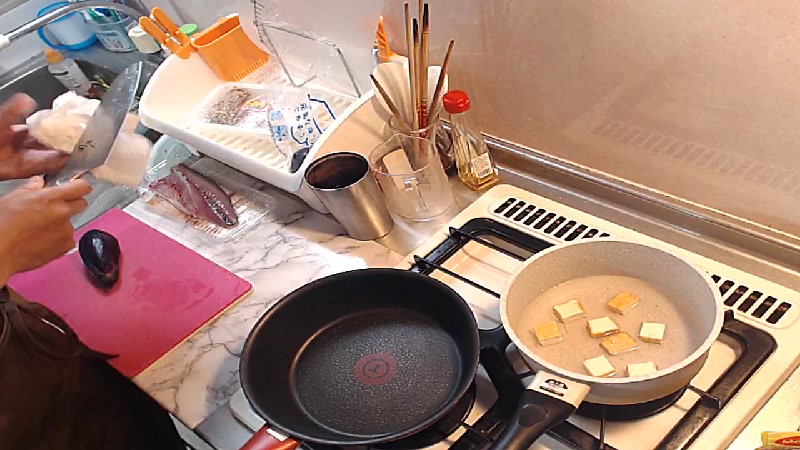
Where is `counter`? Image resolution: width=800 pixels, height=450 pixels. counter is located at coordinates (196, 363).